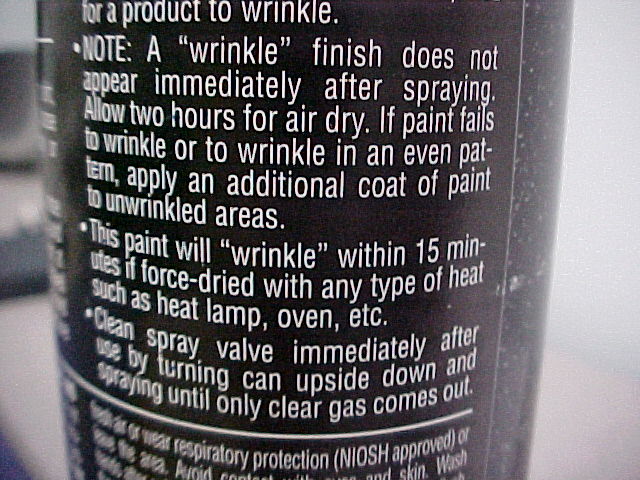
The height and width of the screenshot is (480, 640). In order to click on tabletop background in this screenshot , I will do `click(28, 389)`.